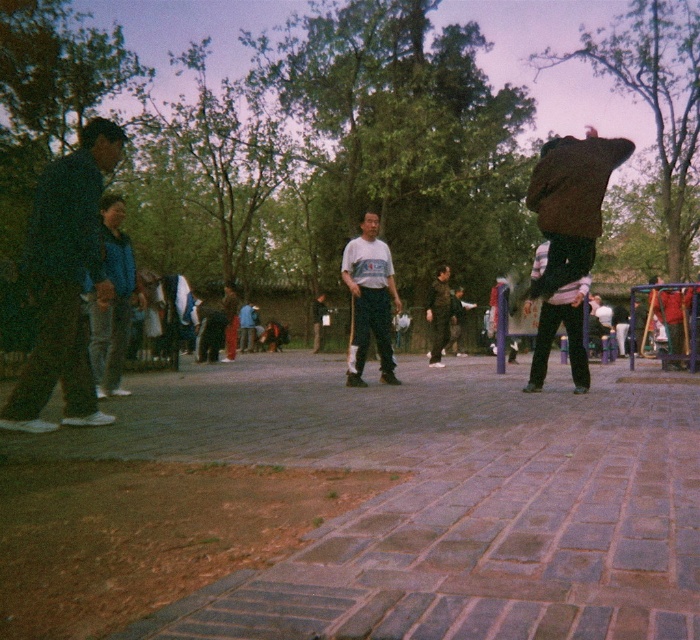
Which of these two, dark brown leather jacket at right or white matte shirt at center, stands taller?

dark brown leather jacket at right is taller.

Between dark brown leather jacket at right and white matte shirt at center, which one appears on the left side from the viewer's perspective?

From the viewer's perspective, white matte shirt at center appears more on the left side.

Between point (554, 161) and point (374, 252), which one is positioned in front?

Positioned in front is point (554, 161).

Locate an element on the screen. This screenshot has width=700, height=640. dark brown leather jacket at right is located at coordinates (567, 236).

Does point (83, 346) lie behind point (615, 148)?

No, (83, 346) is closer to viewer.

The width and height of the screenshot is (700, 640). What do you see at coordinates (64, 282) in the screenshot? I see `dark blue suit at left` at bounding box center [64, 282].

What do you see at coordinates (64, 282) in the screenshot? I see `dark blue suit at left` at bounding box center [64, 282].

The image size is (700, 640). In order to click on dark blue suit at left in this screenshot , I will do point(64,282).

Can you confirm if dark blue suit at left is bigger than white matte shirt at center?

Correct, dark blue suit at left is larger in size than white matte shirt at center.

Between point (28, 355) and point (357, 371), which one is positioned behind?

Positioned behind is point (28, 355).

Where is `dark blue suit at left`? The height and width of the screenshot is (640, 700). dark blue suit at left is located at coordinates (64, 282).